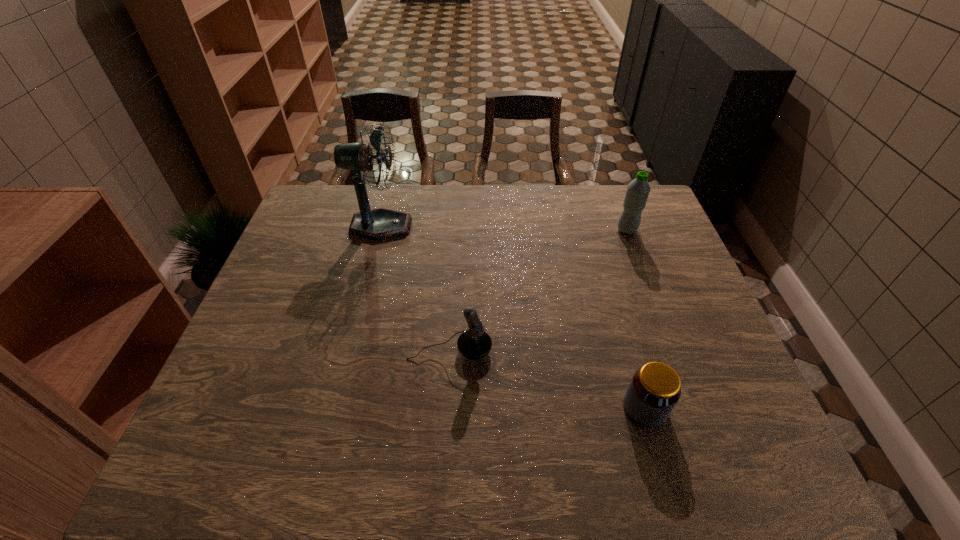
This screenshot has width=960, height=540. In order to click on free location located on the right of the third tallest object in this screenshot , I will do `click(653, 350)`.

Image resolution: width=960 pixels, height=540 pixels. Identify the location of vacant space situated 0.210m on the left of the second object from right to left. (526, 408).

Where is `fan at the far edge`? fan at the far edge is located at coordinates (377, 224).

The height and width of the screenshot is (540, 960). I want to click on water bottle situated at the far edge, so click(x=638, y=190).

Where is `object that is at the right edge`? This screenshot has width=960, height=540. object that is at the right edge is located at coordinates (638, 190).

Find the location of `object present at the far right corner`. object present at the far right corner is located at coordinates (638, 190).

What are the coordinates of `free region at the far edge of the desktop` in the screenshot? It's located at (439, 193).

The image size is (960, 540). I want to click on vacant space at the near edge of the desktop, so click(598, 459).

What are the coordinates of `vacant area at the left edge of the desktop` in the screenshot? It's located at (307, 325).

The image size is (960, 540). Find the location of `vacant area at the right edge`. vacant area at the right edge is located at coordinates (657, 266).